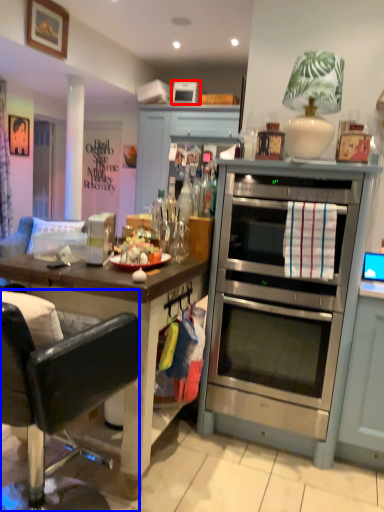
Question: Which object appears closest to the camera in this image, appliance (highlighted by a red box) or chair (highlighted by a blue box)?

Choices:
 (A) appliance
 (B) chair

Answer: (B)